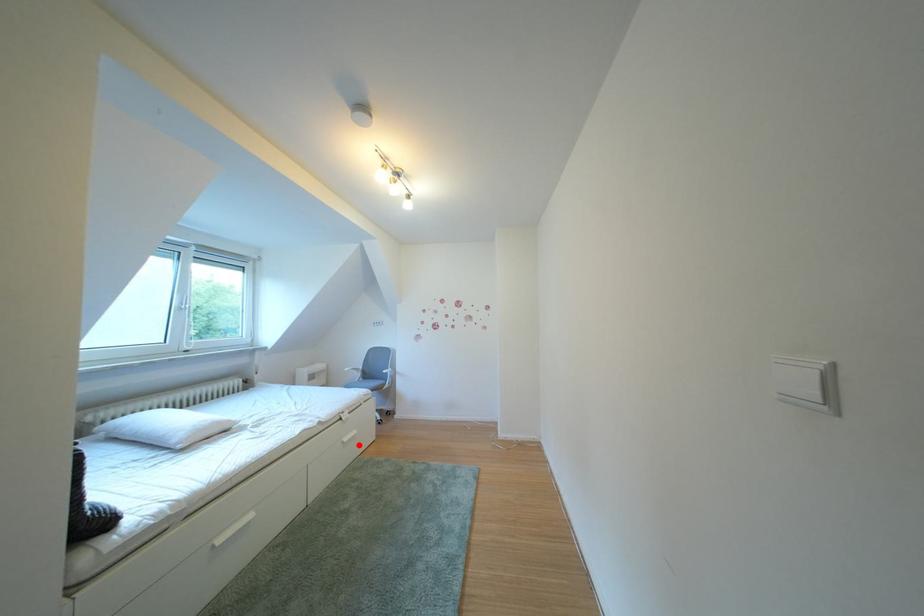
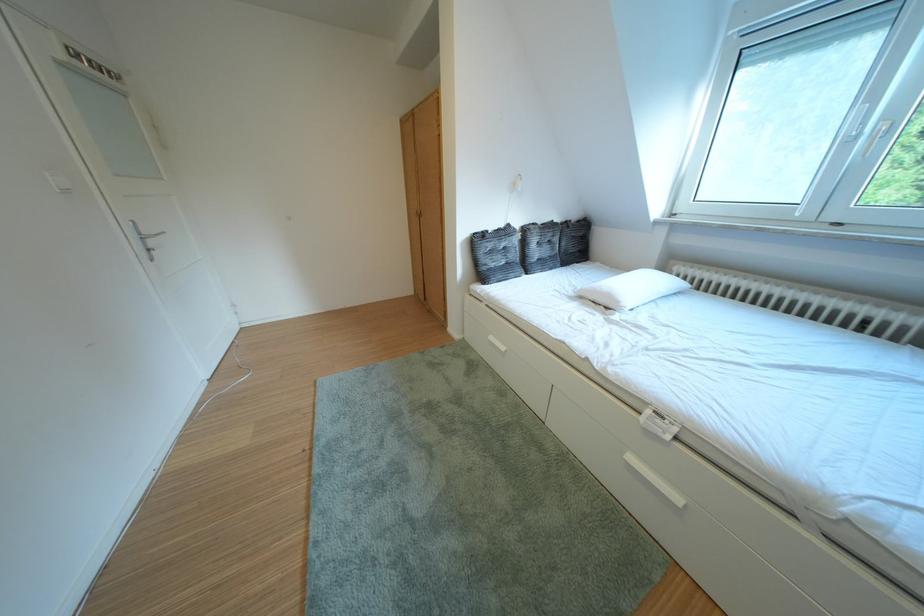
Question: I am providing you with two images of the same scene from different viewpoints. A red point is shown in image1. For the corresponding object point in image2, is it positioned nearer or farther from the camera?

Choices:
 (A) Nearer
 (B) Farther

Answer: (B)